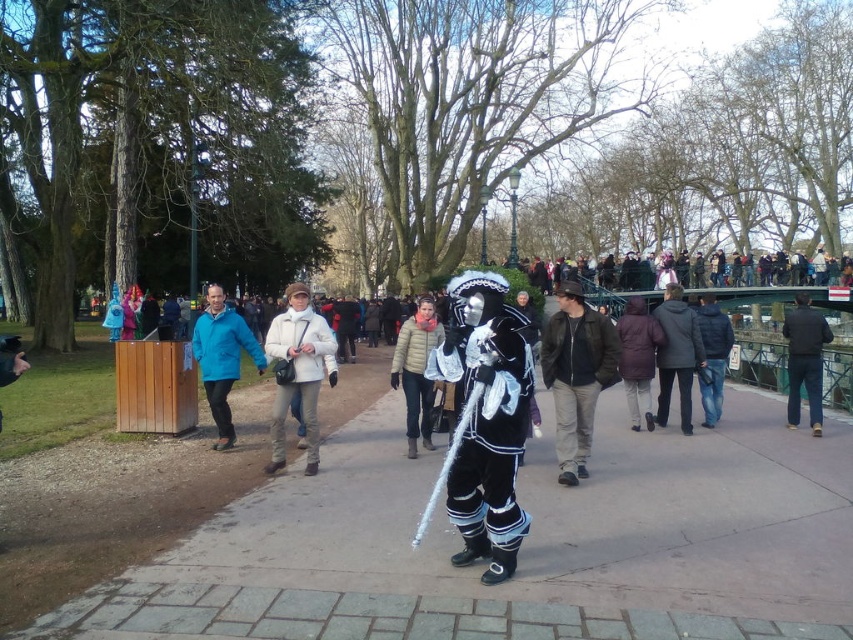
Consider the image. Can you confirm if leather jacket at center is positioned to the right of dark clothing crowd at upper center?

No, leather jacket at center is not to the right of dark clothing crowd at upper center.

Does leather jacket at center come in front of dark clothing crowd at upper center?

Yes.

Which is behind, point (556, 380) or point (712, 285)?

The point (712, 285) is behind.

I want to click on leather jacket at center, so click(x=576, y=374).

Who is positioned more to the left, dark blue puffy jacket at center or dark clothing crowd at upper center?

dark blue puffy jacket at center

Measure the distance between dark blue puffy jacket at center and dark clothing crowd at upper center.

A distance of 23.07 meters exists between dark blue puffy jacket at center and dark clothing crowd at upper center.

Find the location of `dark blue puffy jacket at center`. dark blue puffy jacket at center is located at coordinates (712, 356).

Image resolution: width=853 pixels, height=640 pixels. I want to click on dark blue puffy jacket at center, so click(712, 356).

Can you confirm if smooth concrete pavement at center is positioned below black velvet costume at center?

Yes, smooth concrete pavement at center is below black velvet costume at center.

Is smooth concrete pavement at center thinner than black velvet costume at center?

In fact, smooth concrete pavement at center might be wider than black velvet costume at center.

Is point (248, 548) more distant than point (521, 518)?

Yes.

Locate an element on the screen. The height and width of the screenshot is (640, 853). smooth concrete pavement at center is located at coordinates (521, 547).